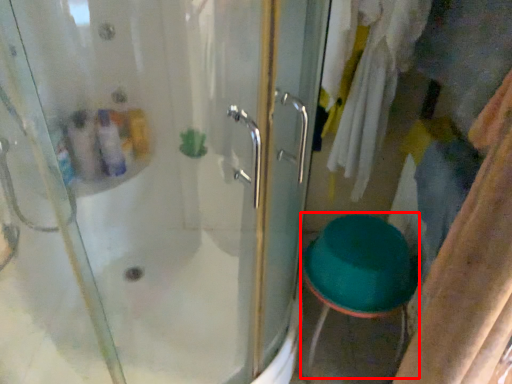
Question: From the image's perspective, considering the relative positions of step stool (annotated by the red box) and door in the image provided, where is step stool (annotated by the red box) located with respect to the staircase?

Choices:
 (A) below
 (B) above

Answer: (A)